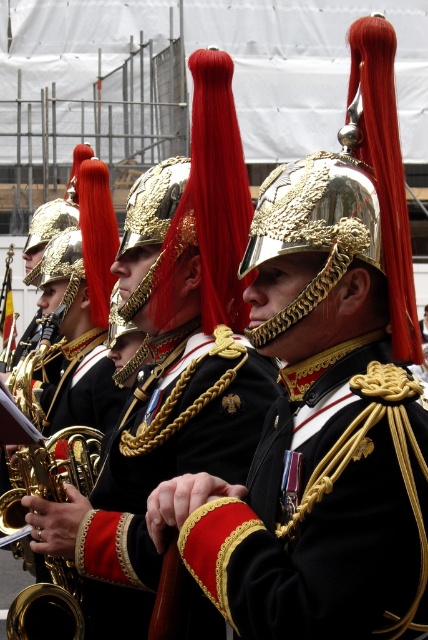
Is point (11, 614) positioned in front of point (143, 288)?

Yes, point (11, 614) is closer to viewer.

Can you confirm if gold brass trumpet at center is bigger than gold/gilded metal helmet at center?

Correct, gold brass trumpet at center is larger in size than gold/gilded metal helmet at center.

Find the location of a particular element. This screenshot has width=428, height=640. gold brass trumpet at center is located at coordinates (48, 608).

Locate an element on the screen. gold brass trumpet at center is located at coordinates (48, 608).